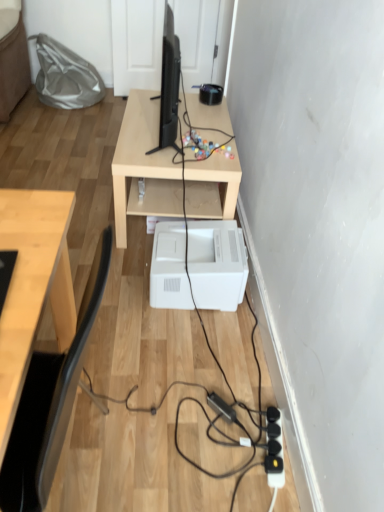
Question: Would you say black matte desktop computer at center is to the left or to the right of light wood table at center in the picture?

Choices:
 (A) right
 (B) left

Answer: (B)

Question: Is black matte desktop computer at center in front of or behind light wood table at center in the image?

Choices:
 (A) front
 (B) behind

Answer: (A)

Question: Estimate the real-world distances between objects in this image. Which object is farther from the black matte desktop computer at center?

Choices:
 (A) black plastic extension cord at lower right
 (B) white plastic printer at lower center
 (C) light wood table at center

Answer: (A)

Question: Which is nearer to the black matte desktop computer at center?

Choices:
 (A) black plastic extension cord at lower right
 (B) white plastic printer at lower center
 (C) light wood table at center

Answer: (C)